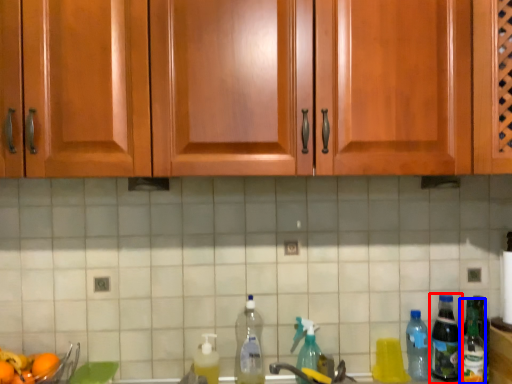
Question: Which of the following is the farthest to the observer, bottle (highlighted by a red box) or bottle (highlighted by a blue box)?

Choices:
 (A) bottle
 (B) bottle

Answer: (A)